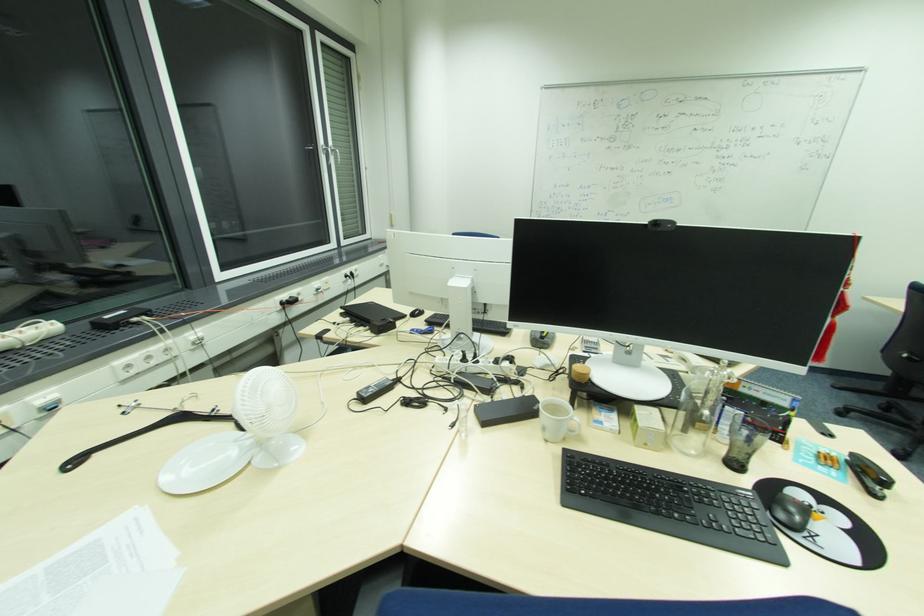
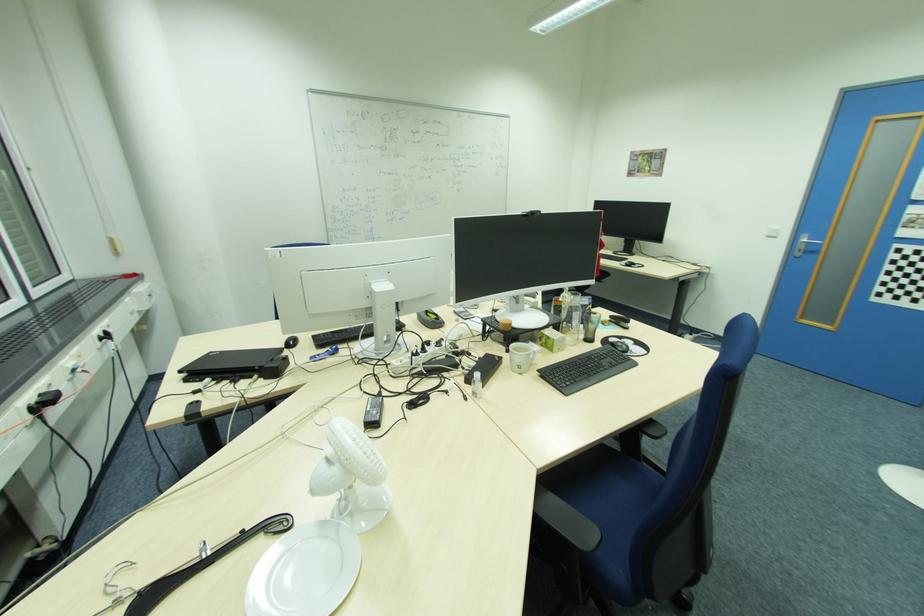
Where in the second image is the point corresponding to point 649,444 from the first image?

(562, 349)